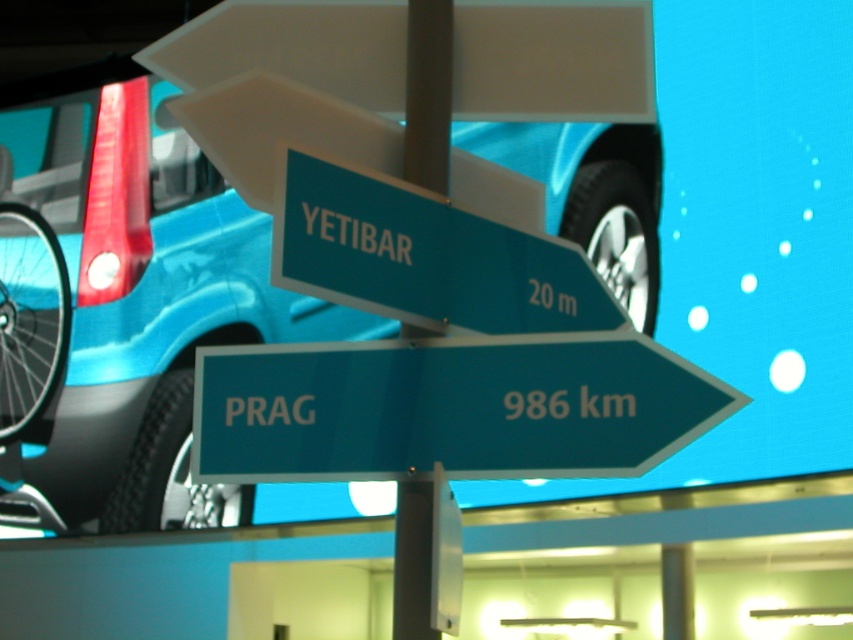
From the picture: You are standing in front of two road signs on a pole. You see a white glossy sign at center and a teal plastic sign at center. Which one is positioned to the left?

The white glossy sign at center is positioned to the left of the teal plastic sign at center.

You are standing in a parking garage and see the metallic blue car at center. The parking spot in front of you is 6 meters long. Can you safely drive your 5.5 meter long car into the spot without hitting the car behind?

The metallic blue car at center is 6.70 meters away from viewer. Since your car is 5.5 meters long and the parking spot is 6 meters long, there is 0.5 meters of extra space. However, the distance to the car is 6.70 meters, which is more than enough to safely park without hitting it.

You are standing at the entrance of a parking garage and see the white glossy sign at center and the green plastic sign at center. You need to place a 1.5 meter wide cart between them. Will there be enough space?

The distance between the white glossy sign at center and the green plastic sign at center is 8.12 meters. Since the cart is 1.5 meters wide, there is sufficient space to place it between them as 8.12 meters is greater than 1.5 meters.